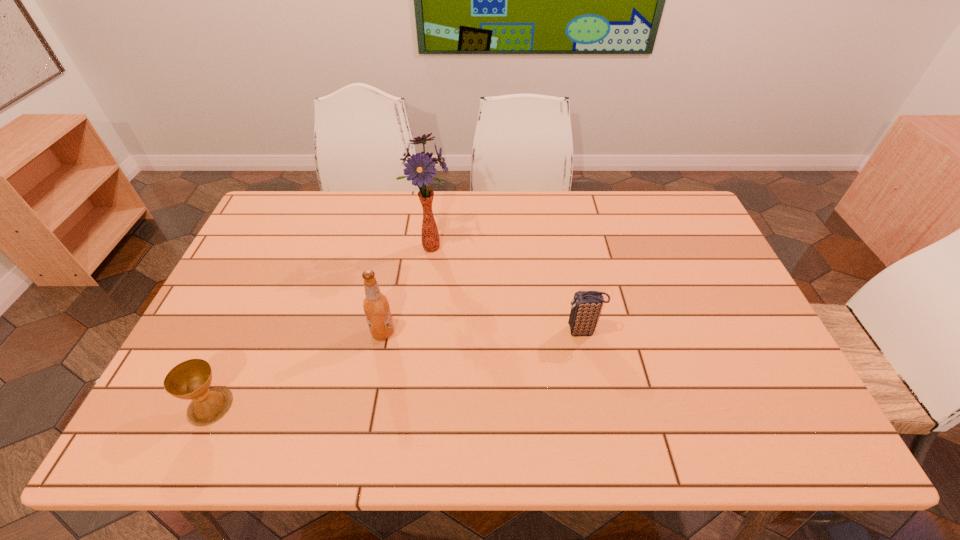
You are a GUI agent. You are given a task and a screenshot of the screen. Output one action in this format:
    pyautogui.click(x=<x>, y=<y>)
    Task: Click on the farthest object
    The width and height of the screenshot is (960, 540).
    Given the screenshot: What is the action you would take?
    pyautogui.click(x=419, y=168)

Where is `flower arrangement`? flower arrangement is located at coordinates (419, 168).

The width and height of the screenshot is (960, 540). What are the coordinates of `the second tallest object` in the screenshot? It's located at (376, 304).

You are a GUI agent. You are given a task and a screenshot of the screen. Output one action in this format:
    pyautogui.click(x=<x>, y=<y>)
    Task: Click on the third tallest object
    The height and width of the screenshot is (540, 960).
    Given the screenshot: What is the action you would take?
    pyautogui.click(x=586, y=307)

This screenshot has width=960, height=540. What are the coordinates of `clutch bag` in the screenshot? It's located at (586, 307).

The width and height of the screenshot is (960, 540). What are the coordinates of `the leftmost object` in the screenshot? It's located at (191, 379).

The height and width of the screenshot is (540, 960). I want to click on chalice, so click(191, 379).

The image size is (960, 540). I want to click on vacant space positioned on the front of the tallest object, so click(x=417, y=370).

I want to click on free space located 0.320m on the front label of the third shortest object, so click(516, 333).

This screenshot has width=960, height=540. What are the coordinates of `blank area located with the zip open on the second shortest object` in the screenshot? It's located at (425, 331).